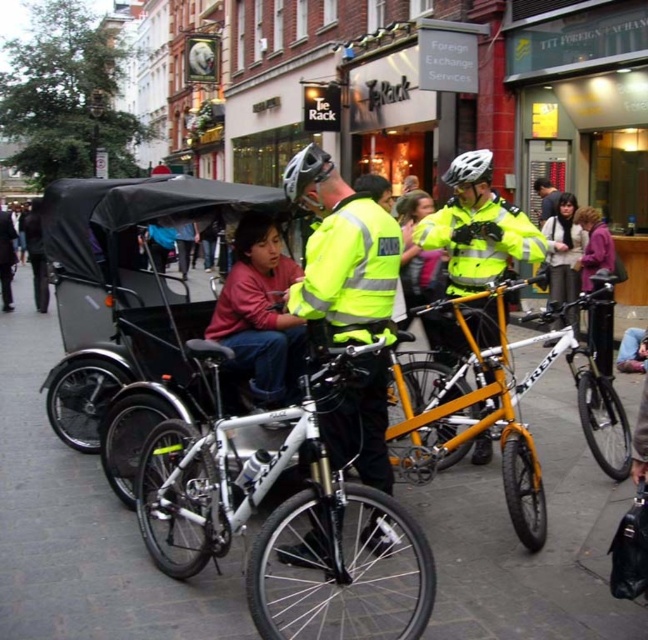
Is the position of orange metallic bicycle at center more distant than that of dark blue jeans at left?

No, it is not.

Between orange metallic bicycle at center and dark blue jeans at left, which one is positioned higher?

dark blue jeans at left

Is point (465, 326) positioned after point (3, 252)?

No, (465, 326) is closer to viewer.

Identify the location of orange metallic bicycle at center. (507, 413).

Measure the distance from white matte pavement at center to white matte trek mountain bike at center.

white matte pavement at center is 11.01 feet from white matte trek mountain bike at center.

Is point (559, 417) positioned in front of point (294, 496)?

No, it is behind (294, 496).

Between point (597, 538) and point (249, 548), which one is positioned in front?

Point (249, 548) is in front.

At what (x,y) coordinates should I click in order to perform the action: click on white matte pavement at center. Please return your answer as a coordinate pair (x, y). Looking at the image, I should click on (82, 525).

Between white matte pavement at center and high-visibility reflective jacket at center, which one appears on the left side from the viewer's perspective?

From the viewer's perspective, white matte pavement at center appears more on the left side.

In order to click on white matte pavement at center in this screenshot , I will do `click(82, 525)`.

Locate an element on the screen. The image size is (648, 640). white matte pavement at center is located at coordinates (82, 525).